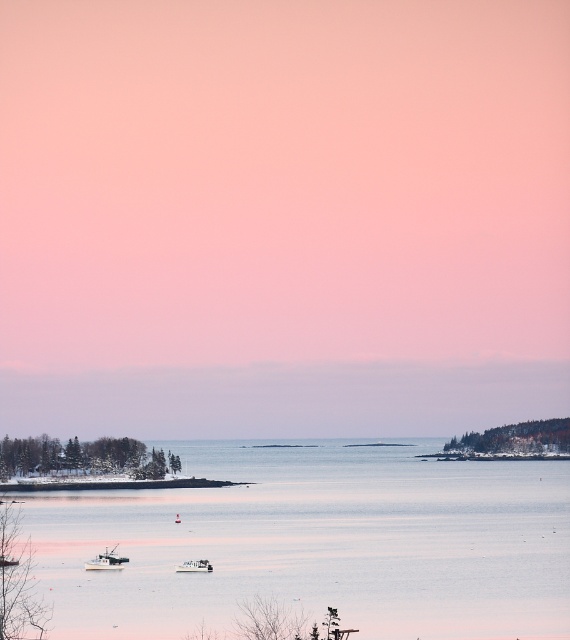
From the picture: Who is positioned more to the right, white matte boat at lower center or white matte boat at center?

From the viewer's perspective, white matte boat at center appears more on the right side.

Can you confirm if white matte boat at lower center is bigger than white matte boat at center?

Indeed, white matte boat at lower center has a larger size compared to white matte boat at center.

Locate an element on the screen. The height and width of the screenshot is (640, 570). white matte boat at lower center is located at coordinates (107, 561).

Which is above, clear water at center or white matte boat at lower center?

clear water at center

Between clear water at center and white matte boat at lower center, which one is positioned lower?

white matte boat at lower center

This screenshot has height=640, width=570. I want to click on clear water at center, so click(315, 545).

Does point (140, 497) lie in front of point (189, 566)?

That is False.

Measure the distance between point (36,564) and camera.

A distance of 180.48 meters exists between point (36,564) and camera.

This screenshot has height=640, width=570. Identify the location of clear water at center. (315, 545).